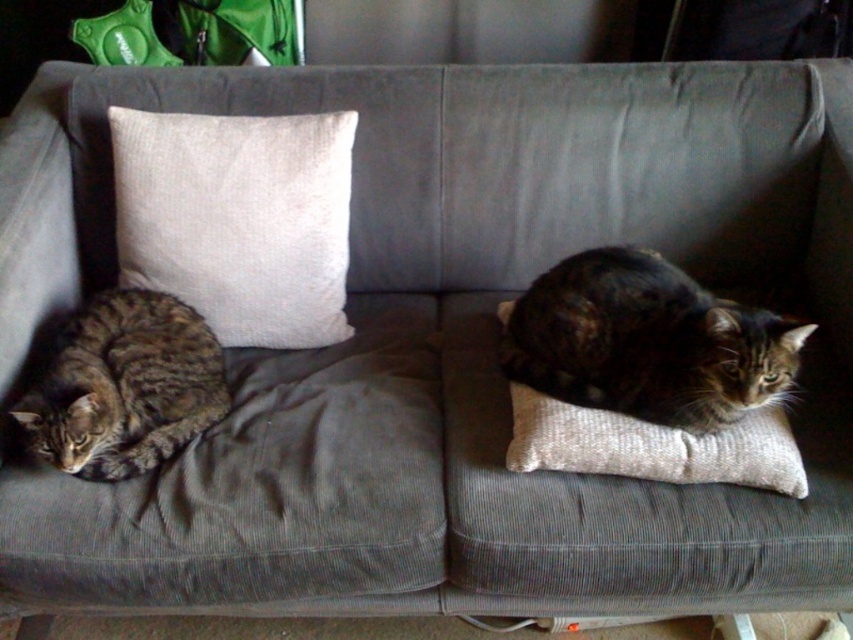
You are a cat owner who wants to ensure both cats have enough space on the sofa. Given that the tabby fur cat at center is wider than the tabby fur cat at left, can you confirm if there is sufficient space for both cats to lie down comfortably without overlapping?

The tabby fur cat at center is wider than the tabby fur cat at left. Since the sofa has two cushions, one on the left and a smaller one on the right, there might be enough space for both cats to lie down comfortably as long as they position themselves on their respective cushions without overlapping.

You are a cat owner who wants to place a new toy on the sofa. The sofa has a white textured pillow at upper left and a tabby fur cat at left. Where should you place the toy so it doesn

The white textured pillow at upper left is above the tabby fur cat at left, so placing the toy on the pillow would keep it elevated and away from the cat.

You are trying to make space for a new throw blanket on the sofa. The sofa currently has a white textured pillow at upper left and a tabby fur cat at center. Which object takes up more space on the sofa?

The tabby fur cat at center takes up more space than the white textured pillow at upper left, so removing the cat would free up more space for the throw blanket.